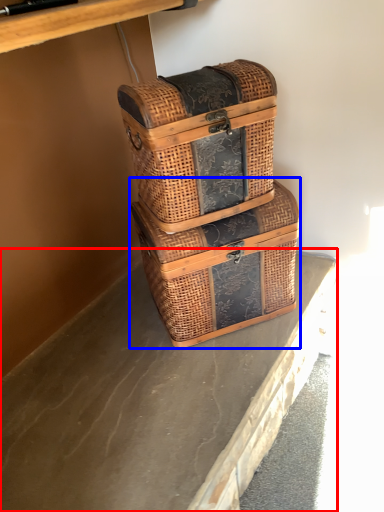
Question: Among these objects, which one is farthest to the camera, concrete (highlighted by a red box) or picnic basket (highlighted by a blue box)?

Choices:
 (A) concrete
 (B) picnic basket

Answer: (B)